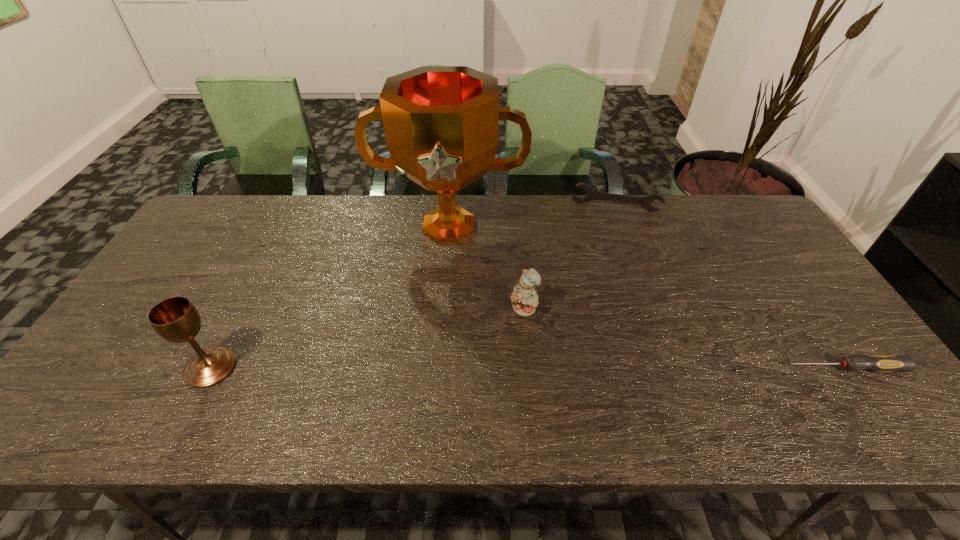
This screenshot has width=960, height=540. I want to click on free location located insert the shortest object into a screw head, so click(664, 368).

The height and width of the screenshot is (540, 960). I want to click on vacant space positioned 0.150m insert the shortest object into a screw head, so 723,368.

What are the coordinates of `free space located insert the shortest object into a screw head` in the screenshot? It's located at (714, 368).

Locate an element on the screen. This screenshot has height=540, width=960. free region located 0.170m on the front-facing side of the third tallest object is located at coordinates (478, 363).

Find the location of `free spot located on the front-facing side of the third tallest object`. free spot located on the front-facing side of the third tallest object is located at coordinates (470, 372).

Where is `vacant area located 0.170m on the front-facing side of the third tallest object`? vacant area located 0.170m on the front-facing side of the third tallest object is located at coordinates (478, 363).

Locate an element on the screen. free space located on the side of the award with the star emblem is located at coordinates (444, 291).

Where is `free location located 0.360m on the side of the award with the star emblem`? free location located 0.360m on the side of the award with the star emblem is located at coordinates (438, 361).

What are the coordinates of `free point located 0.220m on the side of the award with the star emblem` in the screenshot? It's located at (442, 316).

This screenshot has width=960, height=540. What are the coordinates of `vacant area situated 0.130m on the open ends of the fourth tallest object` in the screenshot? It's located at [x=606, y=238].